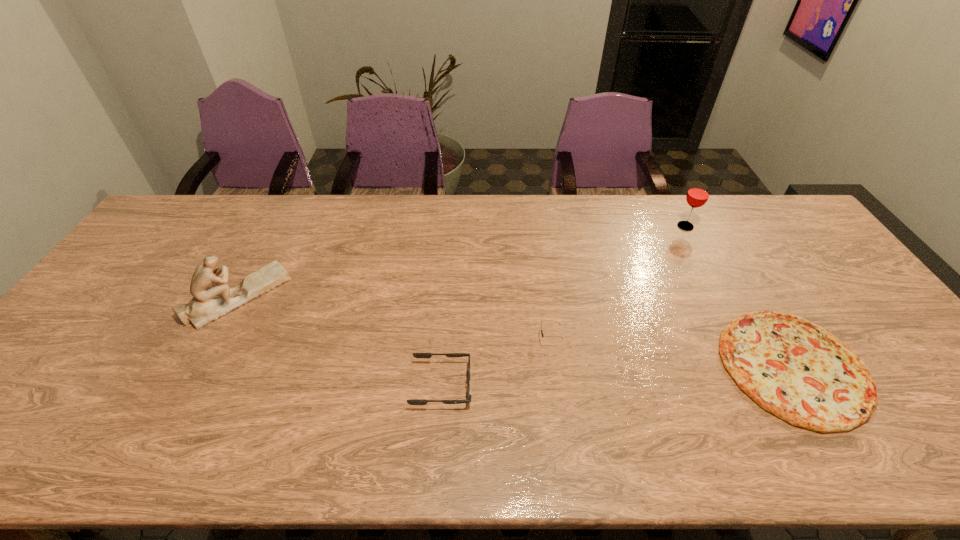
Where is `vacant region that satisfies the following two spatial constraints: 1. on the front side of the glass; 2. in front of the lenses of the third tallest object`? This screenshot has height=540, width=960. vacant region that satisfies the following two spatial constraints: 1. on the front side of the glass; 2. in front of the lenses of the third tallest object is located at coordinates (745, 340).

You are a GUI agent. You are given a task and a screenshot of the screen. Output one action in this format:
    pyautogui.click(x=<x>, y=<y>)
    Task: Click on the free location that satisfies the following two spatial constraints: 1. in front of the lenses of the pizza; 2. on the left side of the right sunglasses
    Image resolution: width=960 pixels, height=540 pixels.
    Given the screenshot: What is the action you would take?
    pyautogui.click(x=553, y=367)

Locate an element on the screen. This screenshot has height=540, width=960. free point that satisfies the following two spatial constraints: 1. in front of the lenses of the third object from left to right; 2. on the left side of the pizza is located at coordinates (553, 367).